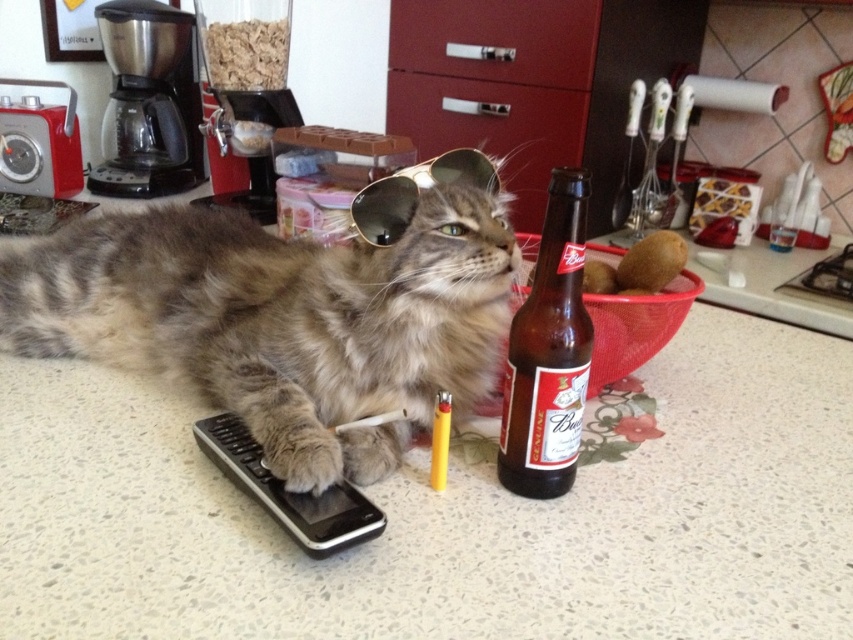
Question: Is brown glass bottle at center-right positioned behind black plastic coffee maker at upper left?

Choices:
 (A) no
 (B) yes

Answer: (A)

Question: Which point appears farthest from the camera in this image?

Choices:
 (A) (201, 177)
 (B) (398, 48)
 (C) (399, 340)

Answer: (A)

Question: Which object appears closest to the camera in this image?

Choices:
 (A) brushed metal coffee machine at upper left
 (B) gold reflective sunglasses at center

Answer: (B)

Question: Which point appears farthest from the camera in this image?

Choices:
 (A) (186, 112)
 (B) (521, 132)
 (C) (469, 13)
 (D) (285, 582)

Answer: (A)

Question: Can you confirm if fuzzy fur cat at center is wider than black plastic coffee maker at upper left?

Choices:
 (A) yes
 (B) no

Answer: (A)

Question: Is brown glass bottle at center-right below matte plastic drawer at upper center?

Choices:
 (A) no
 (B) yes

Answer: (B)